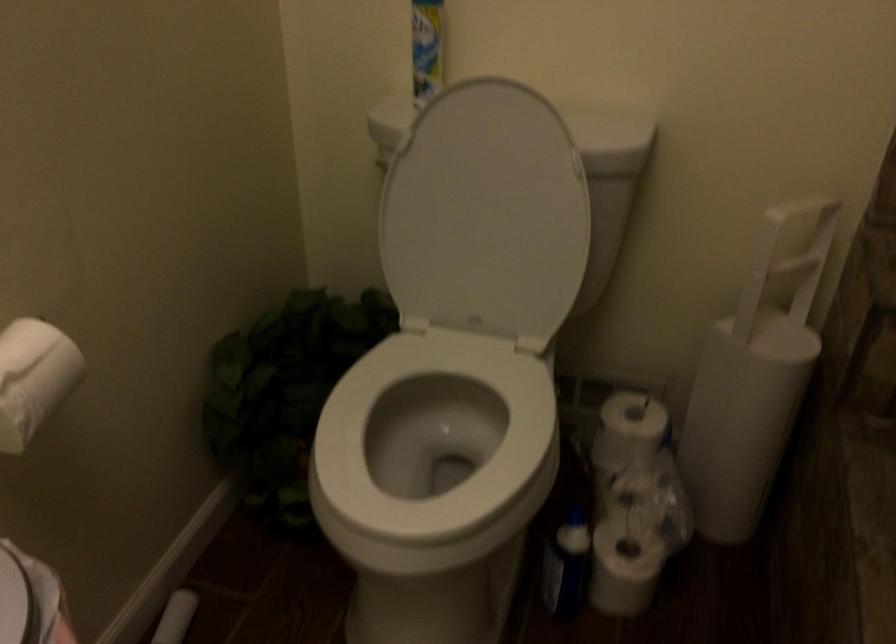
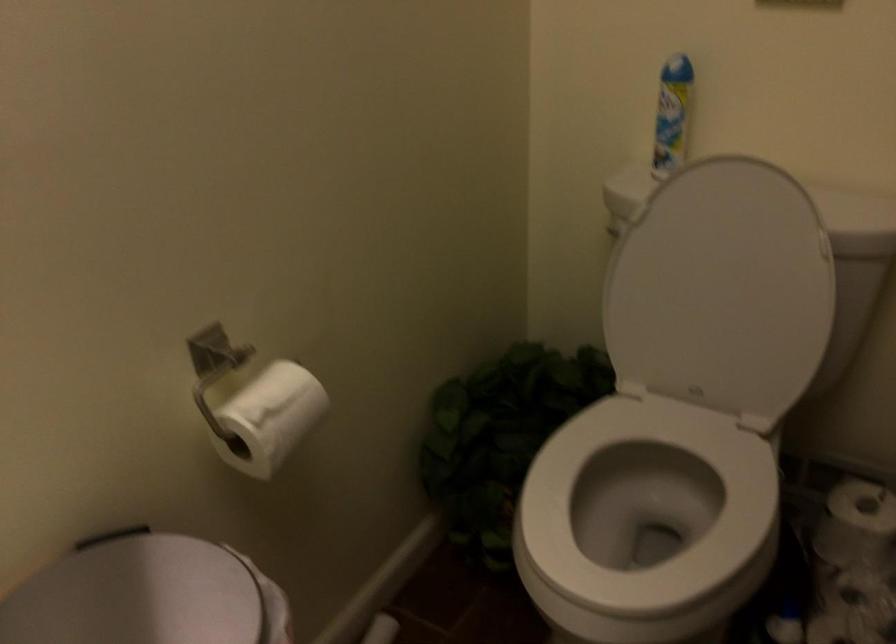
Where in the second image is the point corresponding to pixel 443 448 from the first image?

(645, 516)